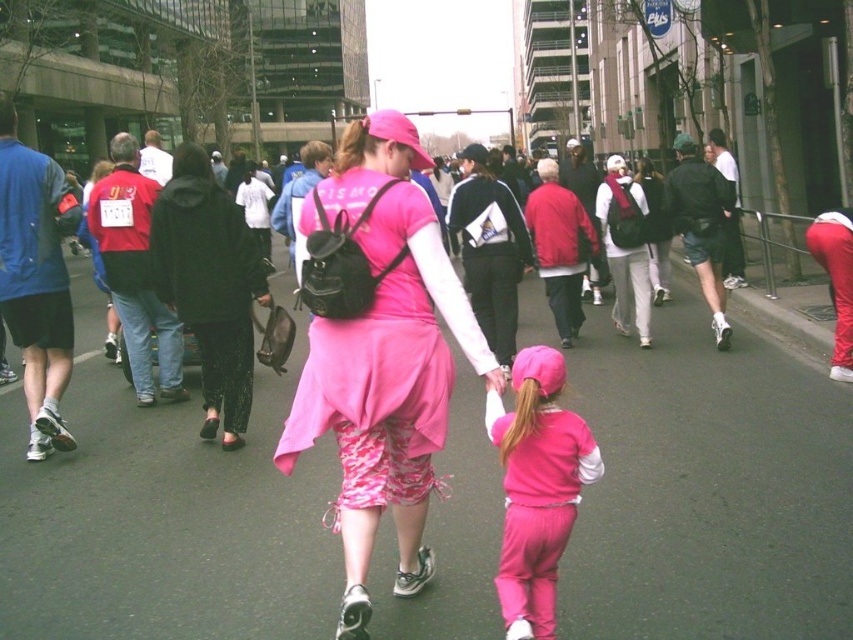
Based on the photo, you are a fashion designer observing the participants in this street scene. You notice two items of clothing at the center of the image. Which clothing item is positioned higher on the body between the matte pink dress at center and the pink fleece pants at center?

The matte pink dress at center is positioned higher on the body than the pink fleece pants at center.

In the scene shown: You are a photographer standing on the sidewalk and want to take a photo of the matte pink dress at center and the pink fleece pants at center. Which one should you focus on first to ensure it appears sharp in the photo?

The matte pink dress at center is closer to you than the pink fleece pants at center, so you should focus on the matte pink dress at center first to ensure it appears sharp in the photo.

You are a photographer at the event and want to capture both the matte pink dress at center and the pink fleece pants at center in a single frame. Which object should you adjust your camera to focus on first if you want to ensure both are in the shot?

The matte pink dress at center is positioned on the left side of pink fleece pants at center, so you should focus on the pink fleece pants at center first to ensure both are captured in the frame.